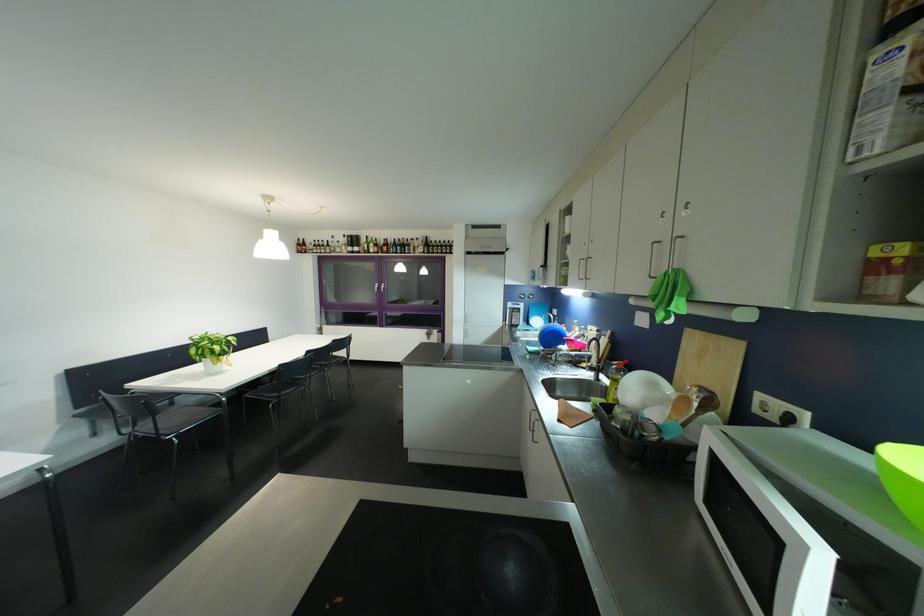
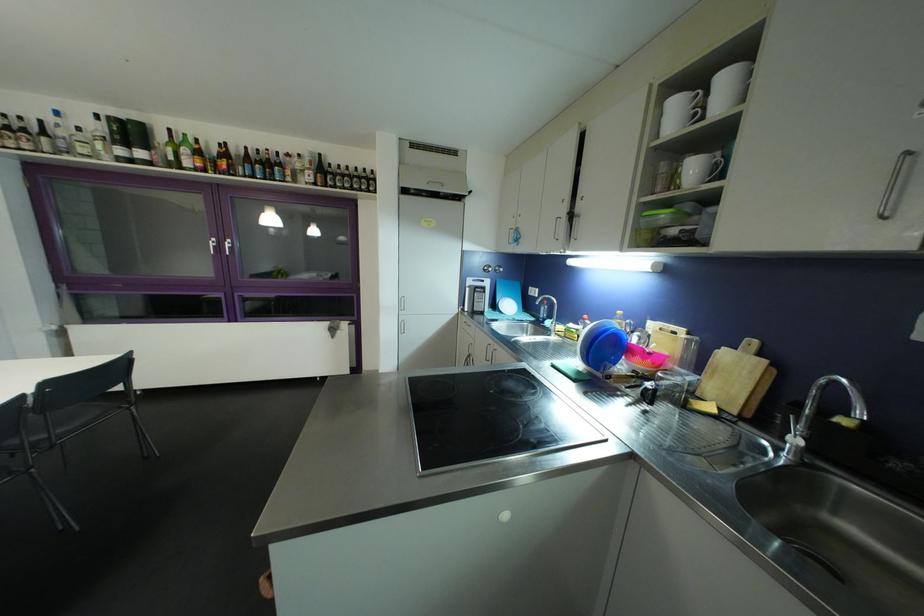
In the second image, find the point that corresponds to point 472,318 in the first image.

(407, 302)